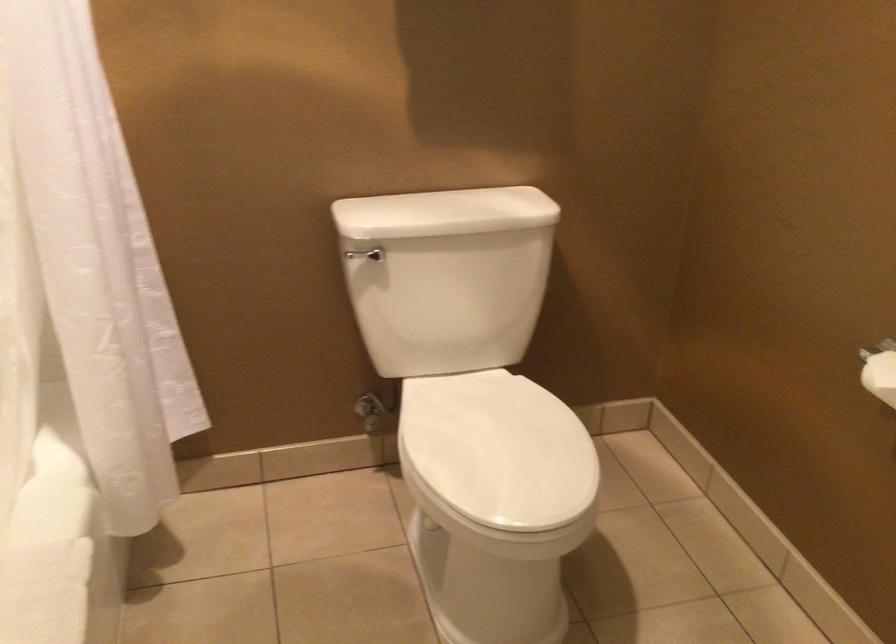
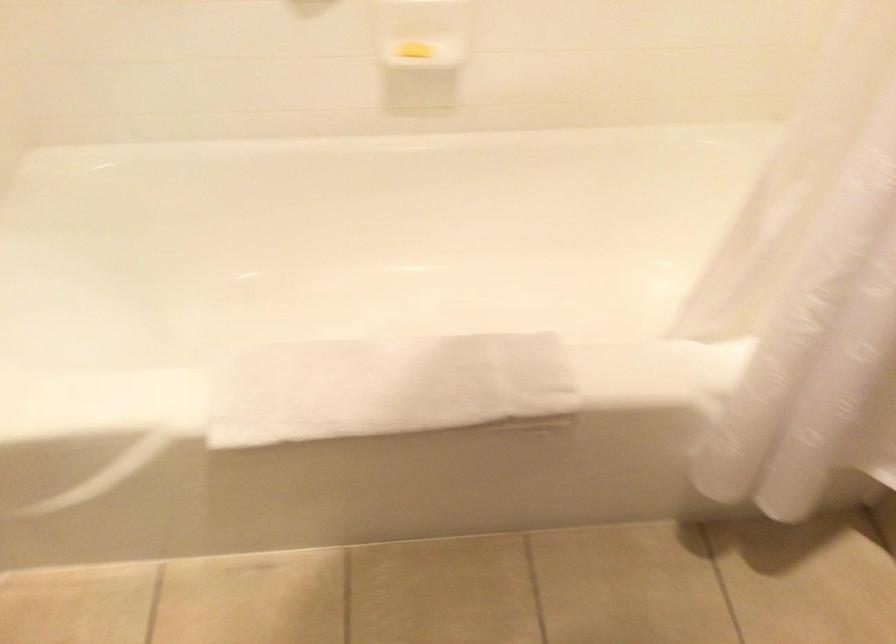
From the picture: The images are taken continuously from a first-person perspective. In which direction is your viewpoint rotating?

The camera rotated toward left-down.